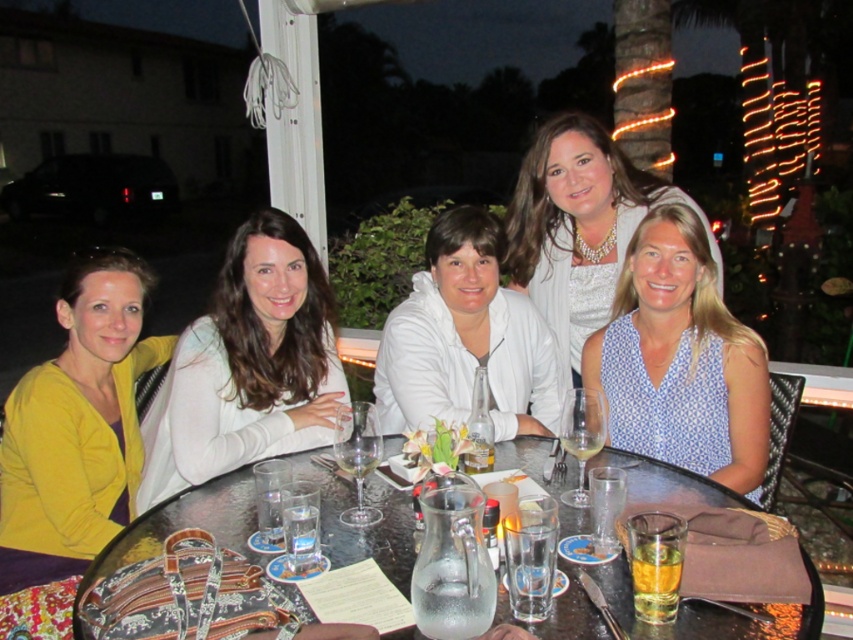
Does white pearl necklace at upper center have a greater width compared to translucent glass at lower right?

Yes, white pearl necklace at upper center is wider than translucent glass at lower right.

Is white pearl necklace at upper center positioned at the back of translucent glass at lower right?

That is True.

Does point (556, 253) come behind point (645, 538)?

That is True.

Where is `white pearl necklace at upper center`? Image resolution: width=853 pixels, height=640 pixels. white pearl necklace at upper center is located at coordinates (576, 227).

Can you confirm if blue printed dress at center is bigger than translucent glass wine at center?

Yes.

Consider the image. Is blue printed dress at center to the right of translucent glass wine at center from the viewer's perspective?

Yes, blue printed dress at center is to the right of translucent glass wine at center.

Which is in front, point (625, 426) or point (575, 428)?

Point (575, 428) is more forward.

The width and height of the screenshot is (853, 640). Find the location of `blue printed dress at center`. blue printed dress at center is located at coordinates (682, 358).

Can you confirm if clear glass table at center is positioned to the left of clear glass wine at center?

In fact, clear glass table at center is to the right of clear glass wine at center.

Can you confirm if clear glass table at center is taller than clear glass wine at center?

Indeed, clear glass table at center has a greater height compared to clear glass wine at center.

Who is more forward, [752,628] or [370,460]?

Positioned in front is point [752,628].

I want to click on clear glass table at center, so click(186, 524).